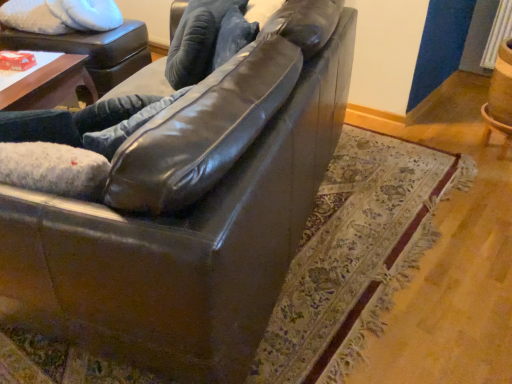
What are the coordinates of `shiny black leather couch at center` in the screenshot? It's located at (142, 95).

Which is closer, (225, 56) or (214, 187)?

Positioned in front is point (214, 187).

Considering the sizes of objects shiny black leather couch at center and shiny brown leather couch at center in the image provided, who is smaller, shiny black leather couch at center or shiny brown leather couch at center?

shiny black leather couch at center.

Is shiny black leather couch at center aimed at shiny brown leather couch at center?

Yes, shiny black leather couch at center is facing shiny brown leather couch at center.

Is shiny black leather couch at center with shiny brown leather couch at center?

There is a gap between shiny black leather couch at center and shiny brown leather couch at center.

Considering the positions of points (160, 173) and (94, 54), is point (160, 173) farther from camera compared to point (94, 54)?

No, (160, 173) is closer to viewer.

From the image's perspective, relative to matte black swivel chair at upper left, is shiny brown leather couch at center above or below?

From the image's perspective, shiny brown leather couch at center appears below matte black swivel chair at upper left.

From a real-world perspective, is shiny brown leather couch at center under matte black swivel chair at upper left?

No, from a real-world perspective, shiny brown leather couch at center is not below matte black swivel chair at upper left.

At what (x,y) coordinates should I click in order to perform the action: click on swivel chair below the shiny brown leather couch at center (from a real-world perspective). Please return your answer as a coordinate pair (x, y). Looking at the image, I should click on (92, 50).

Is matte black swivel chair at upper left next to shiny black leather couch at center and touching it?

matte black swivel chair at upper left is not next to shiny black leather couch at center, and they're not touching.

Is matte black swivel chair at upper left oriented towards shiny black leather couch at center?

No, matte black swivel chair at upper left is not oriented towards shiny black leather couch at center.

Choose the correct answer: Is matte black swivel chair at upper left inside shiny black leather couch at center or outside it?

matte black swivel chair at upper left cannot be found inside shiny black leather couch at center.

Is point (122, 68) closer or farther from the camera than point (51, 127)?

Point (122, 68).

Is shiny black leather couch at center surrounded by shiny brown leather couch at center?

Yes, shiny brown leather couch at center contains shiny black leather couch at center.

Consider the image. How many degrees apart are the facing directions of shiny brown leather couch at center and shiny black leather couch at center?

47 degrees separate the facing orientations of shiny brown leather couch at center and shiny black leather couch at center.

Considering their positions, is shiny brown leather couch at center located in front of or behind shiny black leather couch at center?

shiny brown leather couch at center is positioned closer to the viewer than shiny black leather couch at center.

Considering the positions of objects shiny brown leather couch at center and shiny black leather couch at center in the image provided, who is more to the left, shiny brown leather couch at center or shiny black leather couch at center?

shiny black leather couch at center.

From the image's perspective, is shiny black leather couch at center over matte black swivel chair at upper left?

No, from the image's perspective, shiny black leather couch at center is not above matte black swivel chair at upper left.

Is shiny black leather couch at center oriented away from matte black swivel chair at upper left?

No, shiny black leather couch at center is not facing the opposite direction of matte black swivel chair at upper left.

Are matte black swivel chair at upper left and shiny brown leather couch at center making contact?

There is a gap between matte black swivel chair at upper left and shiny brown leather couch at center.

Is matte black swivel chair at upper left positioned behind shiny brown leather couch at center?

Yes, matte black swivel chair at upper left is further from the viewer.

From a real-world perspective, between matte black swivel chair at upper left and shiny brown leather couch at center, who is vertically higher?

shiny brown leather couch at center, from a real-world perspective.

Looking at the image, does matte black swivel chair at upper left seem bigger or smaller compared to shiny brown leather couch at center?

Clearly, matte black swivel chair at upper left is smaller in size than shiny brown leather couch at center.

Identify the location of couple above the shiny brown leather couch at center (from a real-world perspective). This screenshot has width=512, height=384. (142, 95).

Locate an element on the screen. studio couch in front of the matte black swivel chair at upper left is located at coordinates (191, 211).

Estimate the real-world distances between objects in this image. Which object is closer to shiny brown leather couch at center, matte black swivel chair at upper left or shiny black leather couch at center?

shiny black leather couch at center.

Which object lies nearer to the anchor point matte black swivel chair at upper left, shiny black leather couch at center or shiny brown leather couch at center?

shiny black leather couch at center.

From the image, which object appears to be farther from shiny black leather couch at center, matte black swivel chair at upper left or shiny brown leather couch at center?

Based on the image, matte black swivel chair at upper left appears to be further to shiny black leather couch at center.

Estimate the real-world distances between objects in this image. Which object is further from shiny black leather couch at center, shiny brown leather couch at center or matte black swivel chair at upper left?

matte black swivel chair at upper left lies further to shiny black leather couch at center than the other object.

From the picture: Which object lies further to the anchor point shiny brown leather couch at center, shiny black leather couch at center or matte black swivel chair at upper left?

The object further to shiny brown leather couch at center is matte black swivel chair at upper left.

Considering their positions, is shiny brown leather couch at center positioned closer to matte black swivel chair at upper left than shiny black leather couch at center?

Based on the image, shiny black leather couch at center appears to be nearer to matte black swivel chair at upper left.

Find the location of `couple located between shiny brown leather couch at center and matte black swivel chair at upper left in the depth direction`. couple located between shiny brown leather couch at center and matte black swivel chair at upper left in the depth direction is located at coordinates (142, 95).